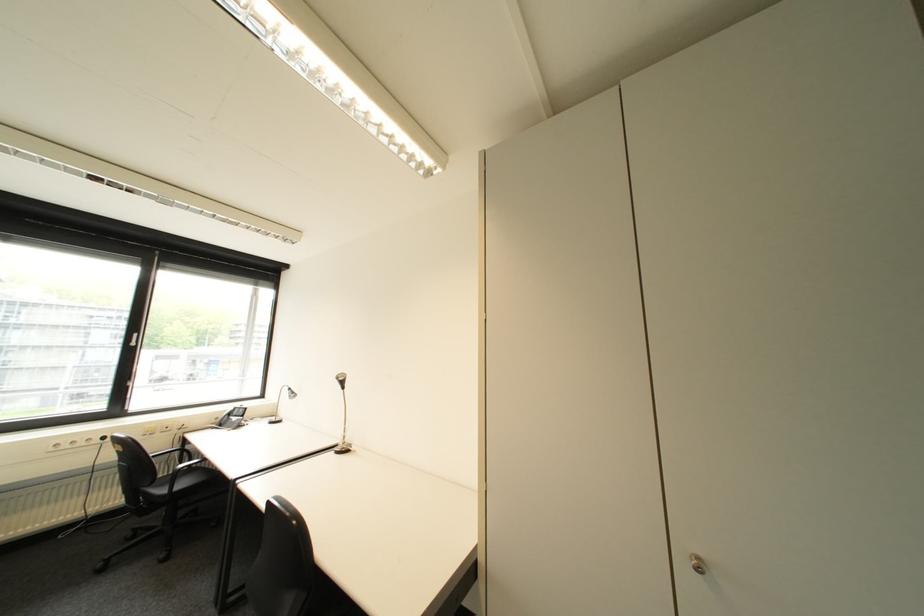
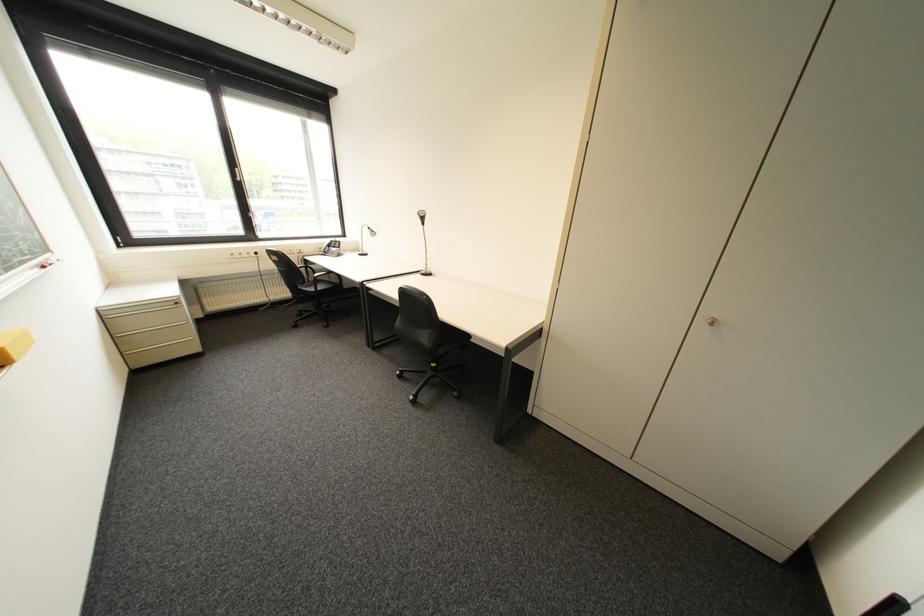
Where in the second image is the point corresponding to the point at 346,450 from the first image?

(432, 273)